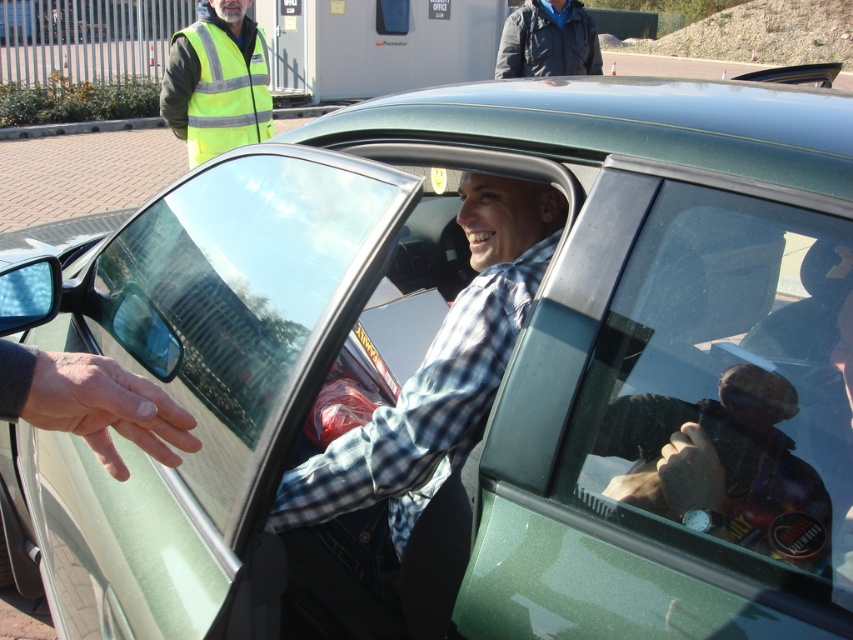
You are standing at the point labeled as point (231, 132) and want to walk to the point labeled as point (491, 355). Based on the scene description, which direction should you move to reach your destination?

To reach point (491, 355) from point (231, 132), you should move forward since point (491, 355) is in front of point (231, 132).

Based on the scene description, what is the 2D coordinate of the checkered fabric shirt at center?

The 2D coordinate of the checkered fabric shirt at center is at point (428, 404).